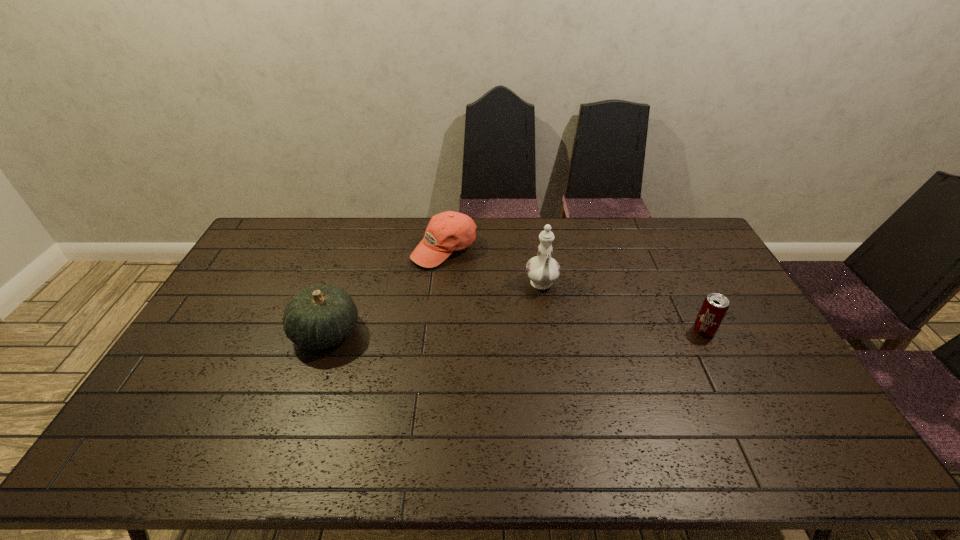
Find the location of a particular element. This screenshot has width=960, height=540. unoccupied position between the farthest object and the beer can is located at coordinates (574, 290).

Where is `empty space between the tallest object and the baseball cap`? The image size is (960, 540). empty space between the tallest object and the baseball cap is located at coordinates (493, 267).

The image size is (960, 540). Identify the location of vacant area that lies between the tallest object and the rightmost object. pyautogui.click(x=623, y=308).

Where is `free space between the tallest object and the rightmost object`? The height and width of the screenshot is (540, 960). free space between the tallest object and the rightmost object is located at coordinates (623, 308).

Select which object is the second closest to the gourd. Please provide its 2D coordinates. Your answer should be formatted as a tuple, i.e. [(x, y)], where the tuple contains the x and y coordinates of a point satisfying the conditions above.

[(542, 270)]

Point out which object is positioned as the nearest to the second tallest object. Please provide its 2D coordinates. Your answer should be formatted as a tuple, i.e. [(x, y)], where the tuple contains the x and y coordinates of a point satisfying the conditions above.

[(449, 231)]

At what (x,y) coordinates should I click in order to perform the action: click on free space in the image that satisfies the following two spatial constraints: 1. on the back side of the rightmost object; 2. on the left side of the third shortest object. Please return your answer as a coordinate pair (x, y). The image size is (960, 540). Looking at the image, I should click on (x=326, y=331).

Where is `free space that satisfies the following two spatial constraints: 1. on the front side of the beer can; 2. on the left side of the baseball cap`? Image resolution: width=960 pixels, height=540 pixels. free space that satisfies the following two spatial constraints: 1. on the front side of the beer can; 2. on the left side of the baseball cap is located at coordinates (436, 331).